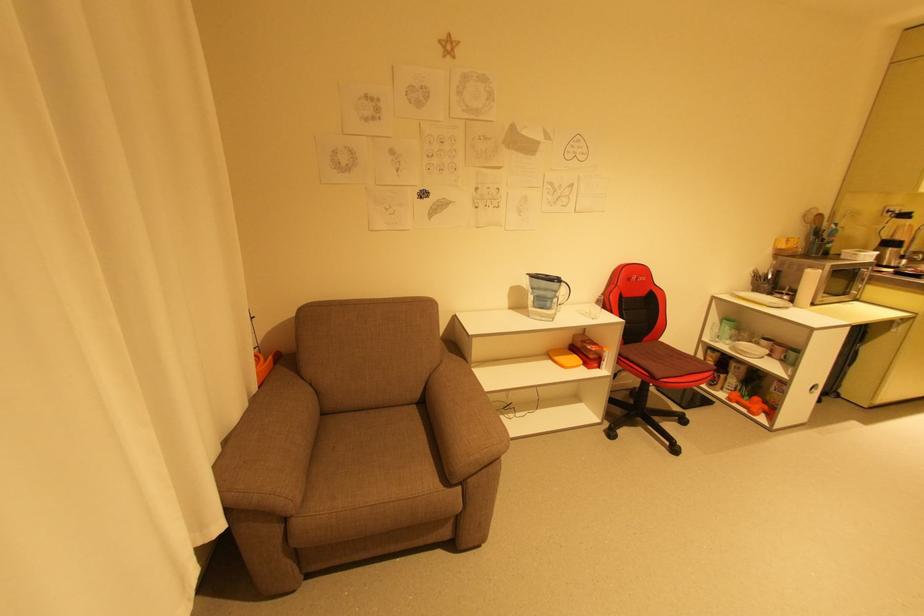
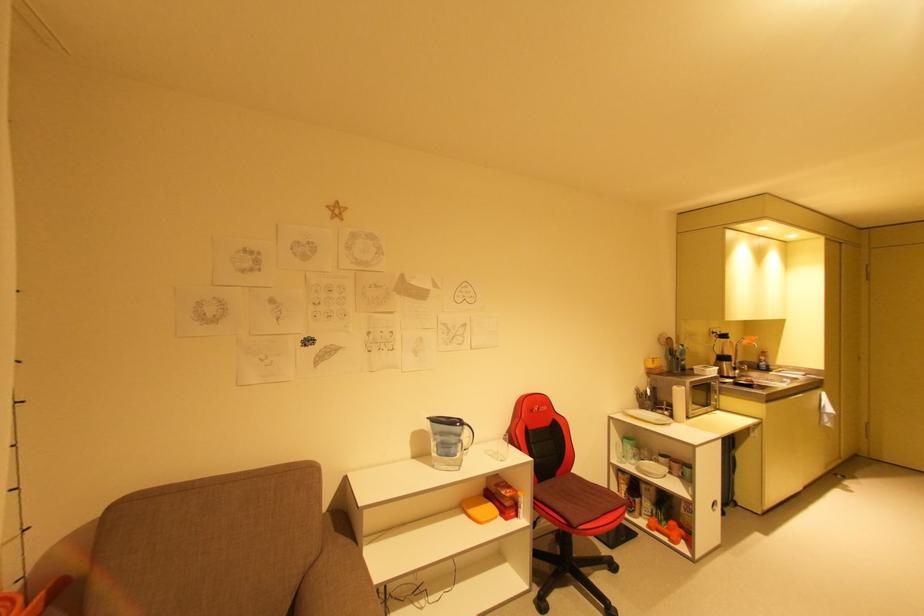
The point at [629,355] is marked in the first image. Where is the corresponding point in the second image?

(544, 498)